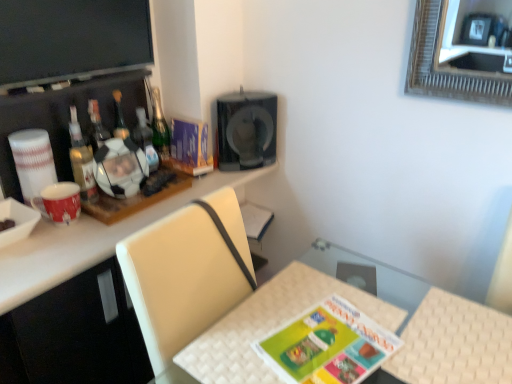
Identify the location of free point above matte green board game at center (from a real-world perspective). The height and width of the screenshot is (384, 512). (327, 341).